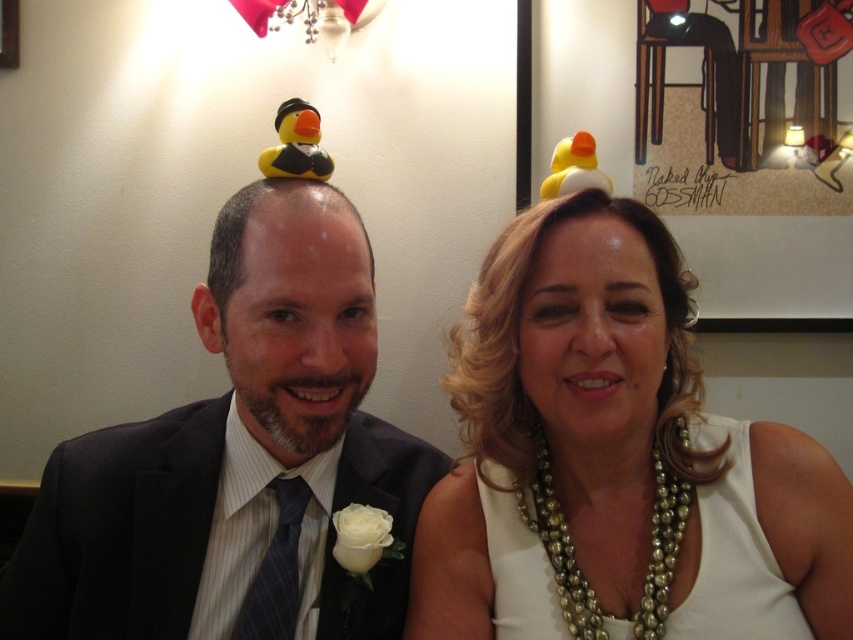
Question: Which of these objects is positioned closest to the matte black suit at left?

Choices:
 (A) white pearl necklace at center
 (B) pearl necklace at upper center

Answer: (B)

Question: Does matte black suit at left appear over white pearl necklace at center?

Choices:
 (A) no
 (B) yes

Answer: (B)

Question: Which point is farther to the camera?

Choices:
 (A) pearl necklace at upper center
 (B) white pearl necklace at center

Answer: (B)

Question: Does matte black suit at left have a greater width compared to white pearl necklace at center?

Choices:
 (A) yes
 (B) no

Answer: (A)

Question: Does pearl necklace at upper center have a smaller size compared to white pearl necklace at center?

Choices:
 (A) no
 (B) yes

Answer: (A)

Question: Which of these objects is positioned closest to the matte black suit at left?

Choices:
 (A) pearl necklace at upper center
 (B) white pearl necklace at center

Answer: (A)